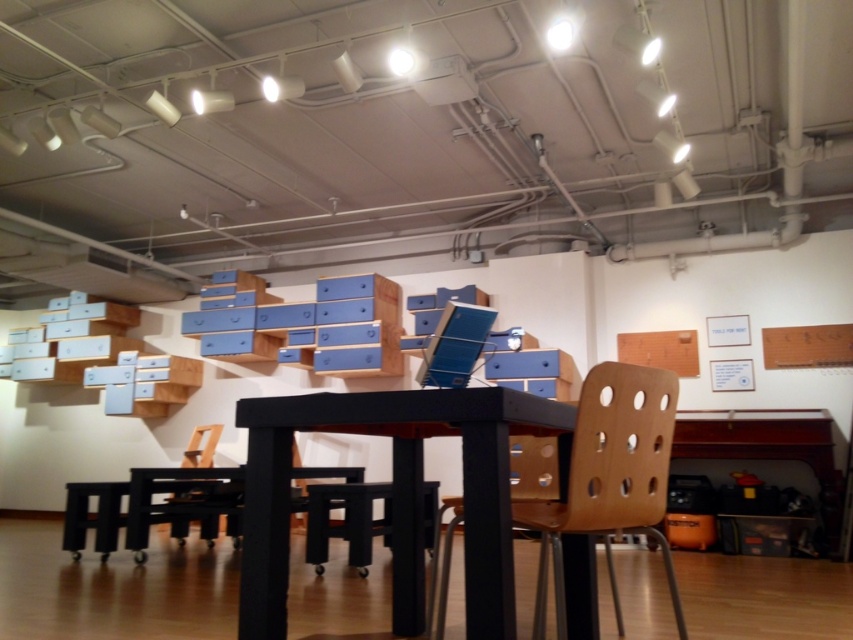
Question: Among these points, which one is farthest from the camera?

Choices:
 (A) (368, 561)
 (B) (608, 515)

Answer: (A)

Question: Is black matte table at center to the right of black plastic stool at lower left from the viewer's perspective?

Choices:
 (A) no
 (B) yes

Answer: (B)

Question: Which object is positioned closest to the matte black stool at center?

Choices:
 (A) wooden chair at lower left
 (B) beech wood chair at center

Answer: (B)

Question: Can you confirm if black matte table at center is positioned below matte black stool at center?

Choices:
 (A) no
 (B) yes

Answer: (A)

Question: Among these objects, which one is nearest to the camera?

Choices:
 (A) wooden chair at lower left
 (B) matte black stool at center

Answer: (B)

Question: Is black matte table at center thinner than wooden chair at lower left?

Choices:
 (A) yes
 (B) no

Answer: (B)